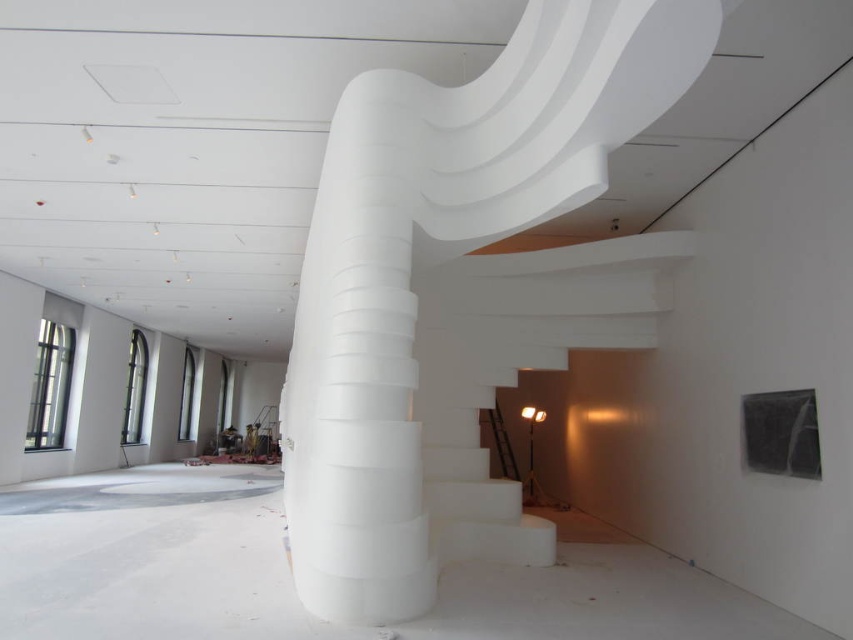
Question: Is white matte staircase at center smaller than white matte stairs at center?

Choices:
 (A) no
 (B) yes

Answer: (A)

Question: Which object is farther from the camera taking this photo?

Choices:
 (A) white matte staircase at center
 (B) white matte stairs at center

Answer: (B)

Question: Does white matte staircase at center have a smaller size compared to white matte stairs at center?

Choices:
 (A) no
 (B) yes

Answer: (A)

Question: Can you confirm if white matte staircase at center is bigger than white matte stairs at center?

Choices:
 (A) yes
 (B) no

Answer: (A)